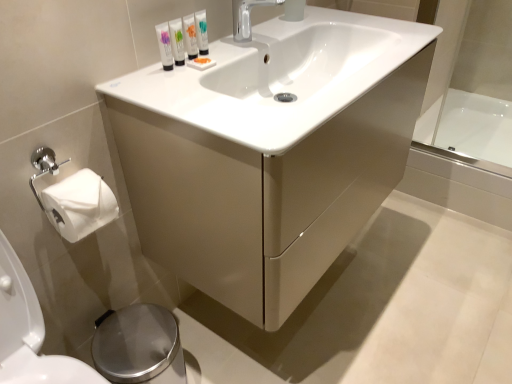
I want to click on vacant space to the right of translucent plastic tubes at upper center, the second mouthwash from the left, so click(x=233, y=59).